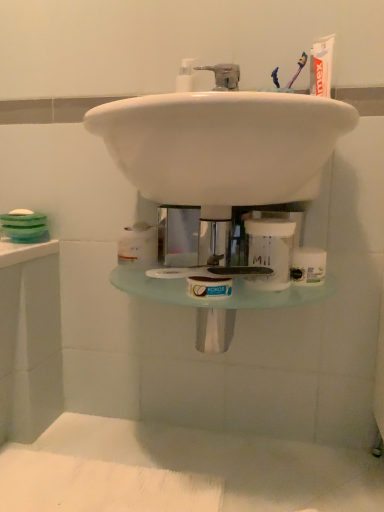
Measure the distance between point (304,120) and camera.

Point (304,120) is 27.28 inches away from camera.

The height and width of the screenshot is (512, 384). What do you see at coordinates (222, 145) in the screenshot?
I see `white glossy sink at center` at bounding box center [222, 145].

The width and height of the screenshot is (384, 512). I want to click on white glossy sink at center, so click(x=222, y=145).

This screenshot has height=512, width=384. What do you see at coordinates (270, 250) in the screenshot? I see `white matte jar at center` at bounding box center [270, 250].

The width and height of the screenshot is (384, 512). Identify the location of white matte jar at center. (270, 250).

Find the location of a particular element. This screenshot has height=512, width=384. white glossy sink at center is located at coordinates (222, 145).

Considering the relative positions of white matte jar at center and white glossy sink at center in the image provided, is white matte jar at center to the left of white glossy sink at center from the viewer's perspective?

No, white matte jar at center is not to the left of white glossy sink at center.

Does white matte jar at center lie behind white glossy sink at center?

Yes, white matte jar at center is behind white glossy sink at center.

Which point is more forward, (276, 274) or (183, 202)?

The point (183, 202) is closer.

From the image's perspective, is white matte jar at center beneath white glossy sink at center?

Yes, from the image's perspective, white matte jar at center is below white glossy sink at center.

From a real-world perspective, between white matte jar at center and white glossy sink at center, who is vertically higher?

white glossy sink at center.

In terms of width, does white matte jar at center look wider or thinner when compared to white glossy sink at center?

In the image, white matte jar at center appears to be more narrow than white glossy sink at center.

Is white matte jar at center taller or shorter than white glossy sink at center?

Considering their sizes, white matte jar at center has less height than white glossy sink at center.

Which of these two, white matte jar at center or white glossy sink at center, is bigger?

With larger size is white glossy sink at center.

Is white matte jar at center spatially inside white glossy sink at center, or outside of it?

white matte jar at center is not enclosed by white glossy sink at center.

Is white matte jar at center beside white glossy sink at center?

No, white matte jar at center is not touching white glossy sink at center.

Could you tell me if white matte jar at center is facing white glossy sink at center?

No, white matte jar at center is not facing towards white glossy sink at center.

Measure the distance from white matte jar at center to white glossy sink at center.

white matte jar at center and white glossy sink at center are 7.89 inches apart from each other.

At what (x,y) coordinates should I click in order to perform the action: click on toiletry located on the right of white glossy sink at center. Please return your answer as a coordinate pair (x, y). The width and height of the screenshot is (384, 512). Looking at the image, I should click on (270, 250).

Is white glossy sink at center to the left or to the right of white matte jar at center in the image?

white glossy sink at center is to the left of white matte jar at center.

Does white glossy sink at center come in front of white matte jar at center?

Yes, it is in front of white matte jar at center.

Is point (211, 112) closer to viewer compared to point (269, 234)?

Yes, point (211, 112) is closer to viewer.

From the image's perspective, does white glossy sink at center appear lower than white matte jar at center?

No, from the image's perspective, white glossy sink at center is not beneath white matte jar at center.

From a real-world perspective, is white glossy sink at center physically located above or below white matte jar at center?

In terms of real-world spatial position, white glossy sink at center is above white matte jar at center.

In terms of width, does white glossy sink at center look wider or thinner when compared to white matte jar at center?

In the image, white glossy sink at center appears to be wider than white matte jar at center.

Is white glossy sink at center taller than white matte jar at center?

Correct, white glossy sink at center is much taller as white matte jar at center.

Considering the sizes of objects white glossy sink at center and white matte jar at center in the image provided, who is bigger, white glossy sink at center or white matte jar at center?

white glossy sink at center.

Would you say white glossy sink at center is outside white matte jar at center?

white glossy sink at center is positioned outside white matte jar at center.

Is white glossy sink at center placed right next to white matte jar at center?

white glossy sink at center is not next to white matte jar at center, and they're not touching.

Could you tell me if white glossy sink at center is turned towards white matte jar at center?

No.

Find the location of a particular element. sink that is above the white matte jar at center (from a real-world perspective) is located at coordinates (222, 145).

Identify the location of toiletry lying on the right of white glossy sink at center. The height and width of the screenshot is (512, 384). (270, 250).

Where is `toiletry beneath the white glossy sink at center (from a real-world perspective)`? Image resolution: width=384 pixels, height=512 pixels. toiletry beneath the white glossy sink at center (from a real-world perspective) is located at coordinates point(270,250).